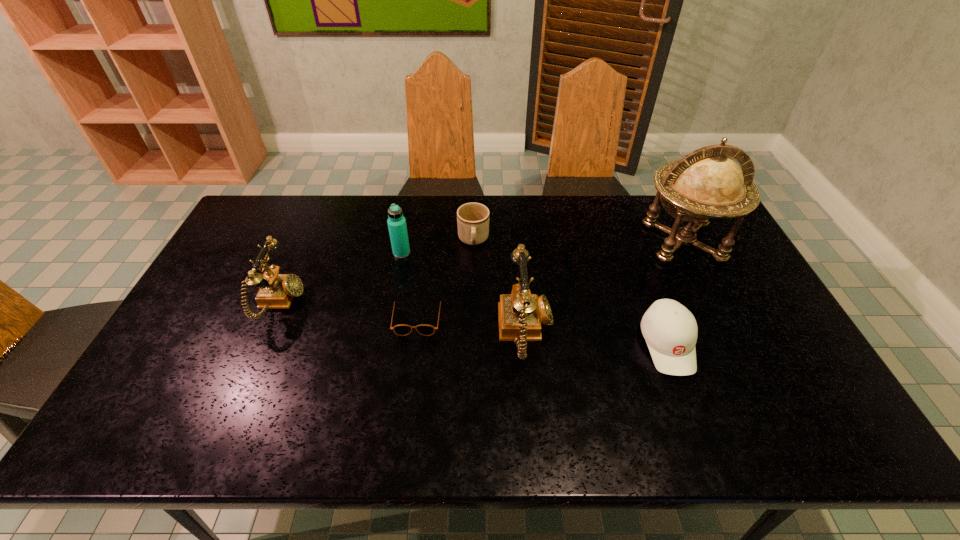
At what (x,y) coordinates should I click in order to perform the action: click on object that is positioned at the right edge. Please return your answer as a coordinate pair (x, y). Looking at the image, I should click on [706, 183].

At what (x,y) coordinates should I click in order to perform the action: click on object that is positioned at the far right corner. Please return your answer as a coordinate pair (x, y). The width and height of the screenshot is (960, 540). Looking at the image, I should click on (706, 183).

At what (x,y) coordinates should I click in order to perform the action: click on vacant region at the far edge of the desktop. Please return your answer as a coordinate pair (x, y). The image size is (960, 540). Looking at the image, I should click on point(520,197).

Locate an element on the screen. vacant space at the near edge of the desktop is located at coordinates click(x=333, y=378).

Where is `free space at the left edge`? The image size is (960, 540). free space at the left edge is located at coordinates (214, 290).

Image resolution: width=960 pixels, height=540 pixels. I want to click on vacant space at the right edge of the desktop, so click(709, 241).

The image size is (960, 540). Identify the location of free spot at the far left corner of the desktop. point(278,206).

The height and width of the screenshot is (540, 960). I want to click on vacant area between the baseball cap and the fourth object from right to left, so click(570, 293).

Find the location of `free spot between the left telephone and the sunglasses`. free spot between the left telephone and the sunglasses is located at coordinates (349, 310).

Find the location of `empty location between the tallest object and the fourth object from left to right`. empty location between the tallest object and the fourth object from left to right is located at coordinates (578, 241).